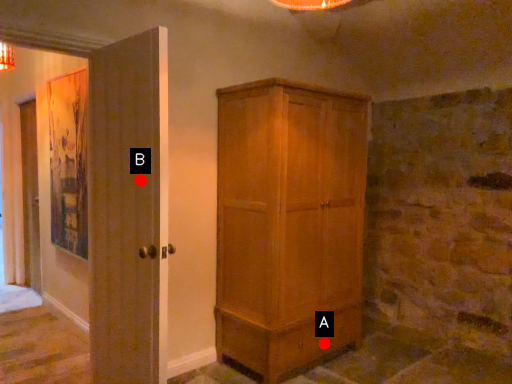
Question: Two points are circled on the image, labeled by A and B beside each circle. Which point is closer to the camera taking this photo?

Choices:
 (A) A is closer
 (B) B is closer

Answer: (B)